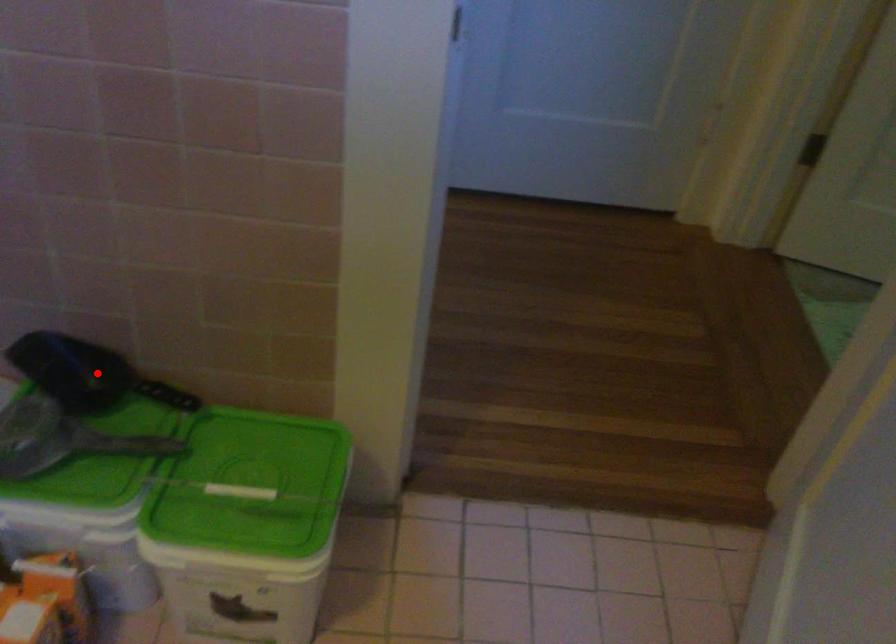
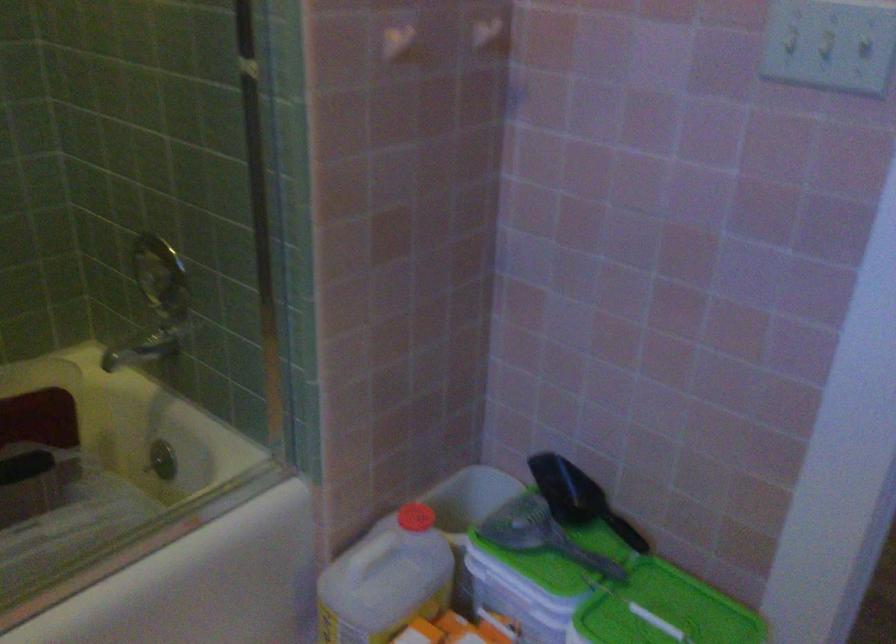
In the second image, find the point that corresponds to the highlighted location in the first image.

(578, 498)